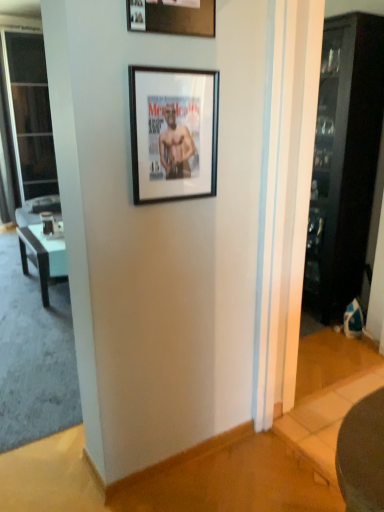
Question: Is point (28, 137) positioned closer to the camera than point (59, 240)?

Choices:
 (A) closer
 (B) farther

Answer: (B)

Question: Is transparent glass screen door at left wider or thinner than black glossy table at left?

Choices:
 (A) wide
 (B) thin

Answer: (A)

Question: Which is farther from the transparent glass screen door at left?

Choices:
 (A) wooden picture frame at upper center, which ranks as the 1th picture frame in top-to-bottom order
 (B) dark wood cabinet at right
 (C) black glossy table at left
 (D) black matte picture frame at upper center, marked as the first picture frame in a bottom-to-top arrangement

Answer: (A)

Question: Considering the real-world distances, which object is farthest from the transparent glass screen door at left?

Choices:
 (A) black matte picture frame at upper center, marked as the first picture frame in a bottom-to-top arrangement
 (B) wooden picture frame at upper center, positioned as the 2th picture frame in bottom-to-top order
 (C) black glossy table at left
 (D) dark wood cabinet at right

Answer: (B)